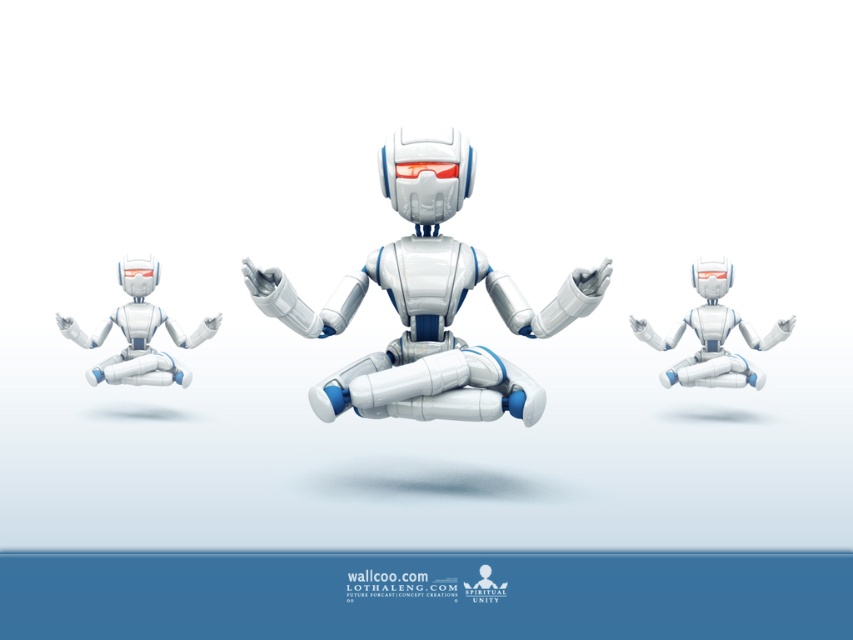
Question: Among these objects, which one is farthest from the camera?

Choices:
 (A) white matte robot at left
 (B) white matte robot at center
 (C) white glossy robot at center

Answer: (B)

Question: Does white glossy robot at center appear on the right side of white matte robot at center?

Choices:
 (A) no
 (B) yes

Answer: (A)

Question: Can you confirm if white glossy robot at center is smaller than white matte robot at left?

Choices:
 (A) no
 (B) yes

Answer: (A)

Question: Which point is farther to the camera?

Choices:
 (A) white matte robot at left
 (B) white matte robot at center

Answer: (B)

Question: Is white matte robot at center thinner than white matte robot at left?

Choices:
 (A) no
 (B) yes

Answer: (A)

Question: Based on their relative distances, which object is farther from the white matte robot at center?

Choices:
 (A) white matte robot at left
 (B) white glossy robot at center

Answer: (B)